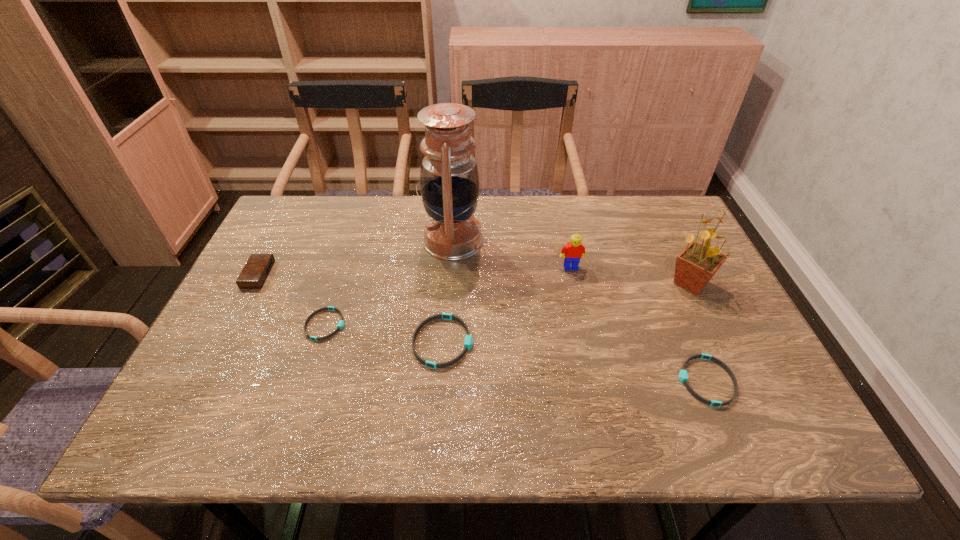
You are a GUI agent. You are given a task and a screenshot of the screen. Output one action in this format:
    pyautogui.click(x=<x>, y=<y>)
    Task: Click on the sixth object from right to left
    The width and height of the screenshot is (960, 540).
    Given the screenshot: What is the action you would take?
    pyautogui.click(x=340, y=325)

Locate an element on the screen. The width and height of the screenshot is (960, 540). the shortest object is located at coordinates (340, 325).

Where is `the second wristband from left to right`? the second wristband from left to right is located at coordinates (468, 342).

The image size is (960, 540). Find the location of `the tallest wristband`. the tallest wristband is located at coordinates (468, 342).

Find the location of a particular element. This screenshot has height=540, width=960. the sixth tallest object is located at coordinates (683, 375).

Where is `the rightmost wristband`? This screenshot has height=540, width=960. the rightmost wristband is located at coordinates (683, 375).

This screenshot has width=960, height=540. In order to click on oil lamp in this screenshot , I will do `click(449, 182)`.

Identify the location of sunflower. (695, 266).

Identify the location of the third tallest object. The image size is (960, 540). (574, 250).

At what (x,y) coordinates should I click in order to perform the action: click on Lego. Please return your answer as a coordinate pair (x, y). Looking at the image, I should click on (574, 250).